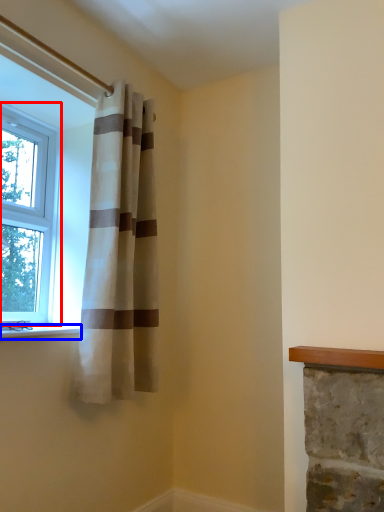
Question: Which object appears farthest to the camera in this image, window (highlighted by a red box) or window sill (highlighted by a blue box)?

Choices:
 (A) window
 (B) window sill

Answer: (A)